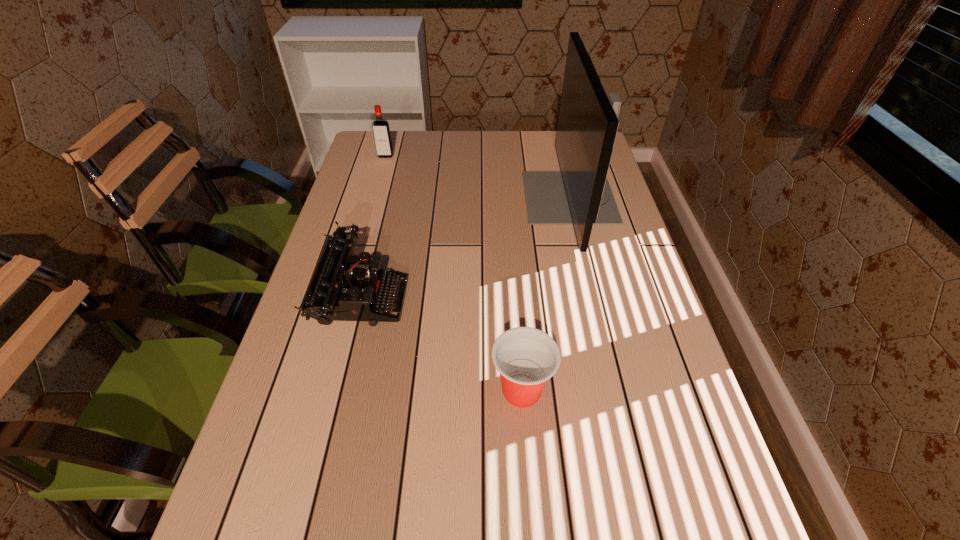
The height and width of the screenshot is (540, 960). Identify the location of computer monitor. (580, 195).

This screenshot has height=540, width=960. I want to click on the third shortest object, so click(x=382, y=137).

Where is `cup`? cup is located at coordinates (526, 357).

You are a GUI agent. You are given a task and a screenshot of the screen. Output one action in this format:
    pyautogui.click(x=<x>, y=<y>)
    Task: Click on the typewriter
    This screenshot has height=540, width=960.
    Given the screenshot: What is the action you would take?
    pyautogui.click(x=340, y=290)

The height and width of the screenshot is (540, 960). I want to click on free space located on the screen of the tallest object, so click(x=466, y=198).

This screenshot has height=540, width=960. I want to click on vacant area located on the screen of the tallest object, so click(x=485, y=198).

You are a GUI agent. You are given a task and a screenshot of the screen. Output one action in this format:
    pyautogui.click(x=<x>, y=<y>)
    Task: Click on the free space located 0.150m on the screen of the tallest object
    Image resolution: width=960 pixels, height=540 pixels.
    Given the screenshot: What is the action you would take?
    pyautogui.click(x=475, y=198)

This screenshot has width=960, height=540. In order to click on free region located on the front and back of the vodka in this screenshot , I will do `click(363, 237)`.

Identify the location of free space located 0.260m on the back of the nearest object. (514, 275).

Locate an element on the screen. free spot located 0.340m on the keyboard of the typewriter is located at coordinates (548, 298).